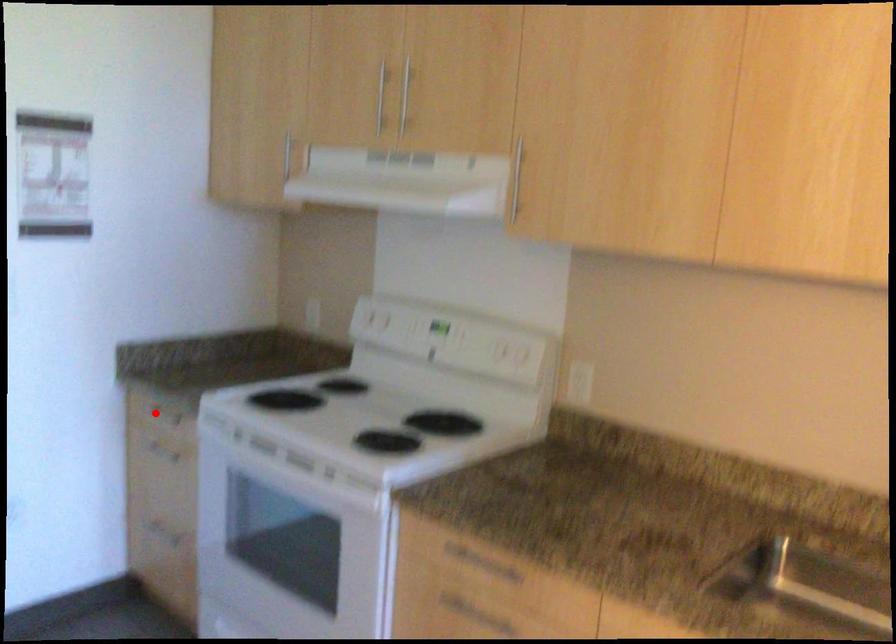
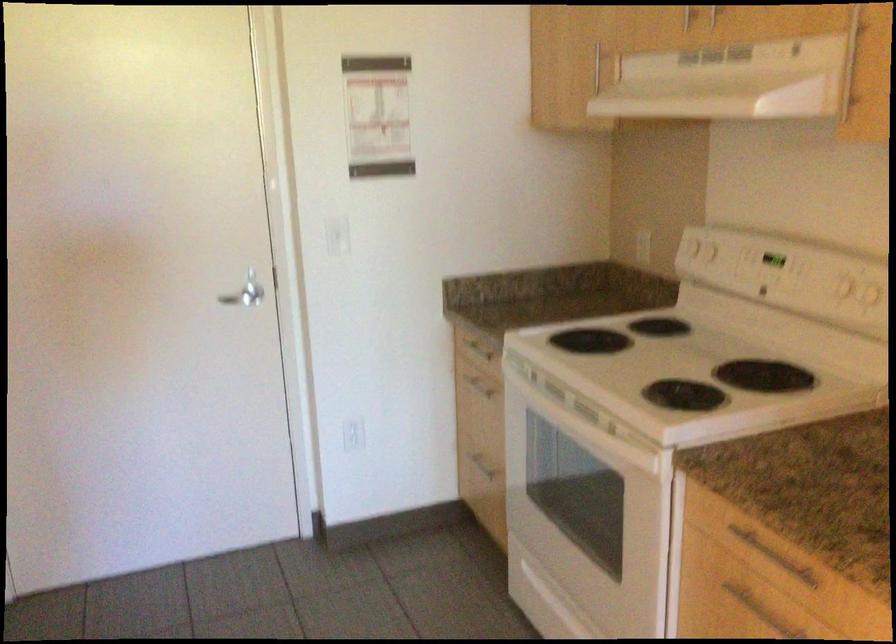
Locate, in the second image, the point that corresponds to the highlighted location in the first image.

(476, 346)